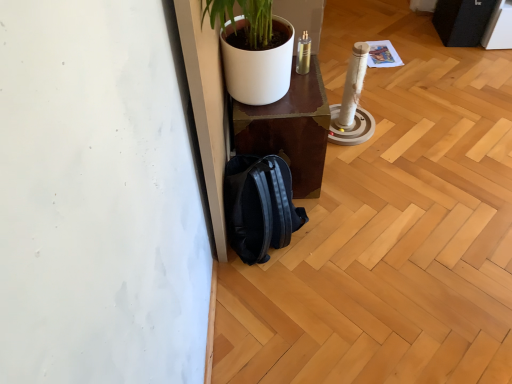
I want to click on free spot in front of black matte backpack at lower center, so click(x=282, y=308).